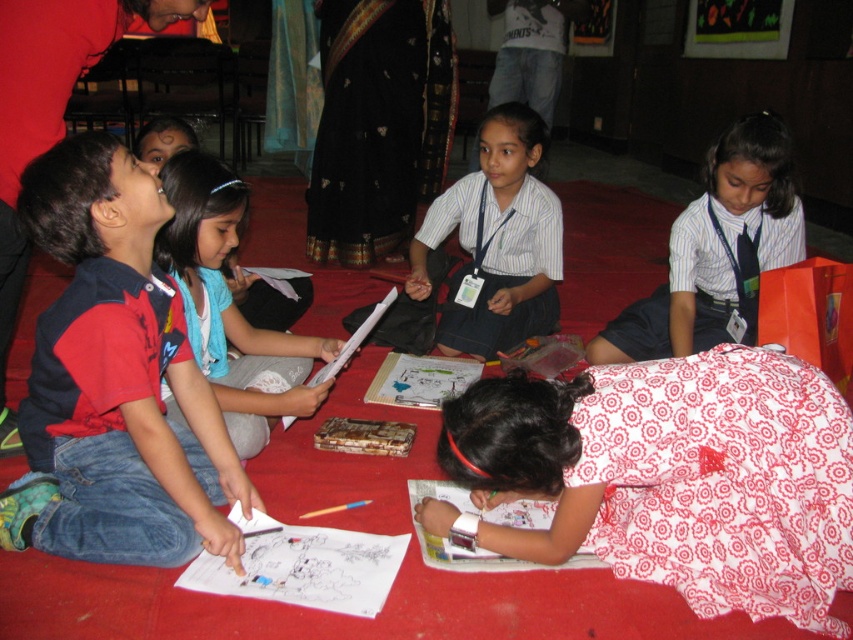
You are a photographer trying to capture a candid shot of the children. You notice the white dotted dress at lower right and the light blue scarf at center. Which clothing item should you focus on to ensure it appears larger in your photo, given their sizes?

The light blue scarf at center should be focused on because it is taller than the white dotted dress at lower right, making it appear larger in the photo.

You are standing in front of the image and want to determine which of the two points, point [695,552] or point [200,256], is closer to you. Based on the scene, which point is nearer?

Point [695,552] is closer to the camera than point [200,256], so it is the nearer point.